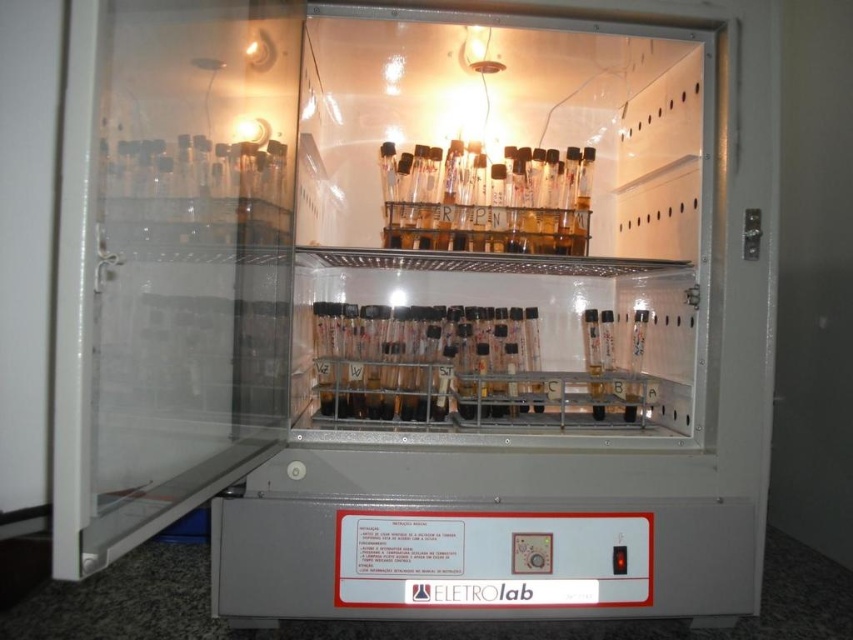
Who is shorter, clear plastic tubes at center or transparent glass test tube at center?

transparent glass test tube at center

Looking at this image, is clear plastic tubes at center thinner than transparent glass test tube at center?

In fact, clear plastic tubes at center might be wider than transparent glass test tube at center.

Between point (447, 339) and point (448, 157), which one is positioned in front?

Point (447, 339)

Locate an element on the screen. The image size is (853, 640). clear plastic tubes at center is located at coordinates (421, 358).